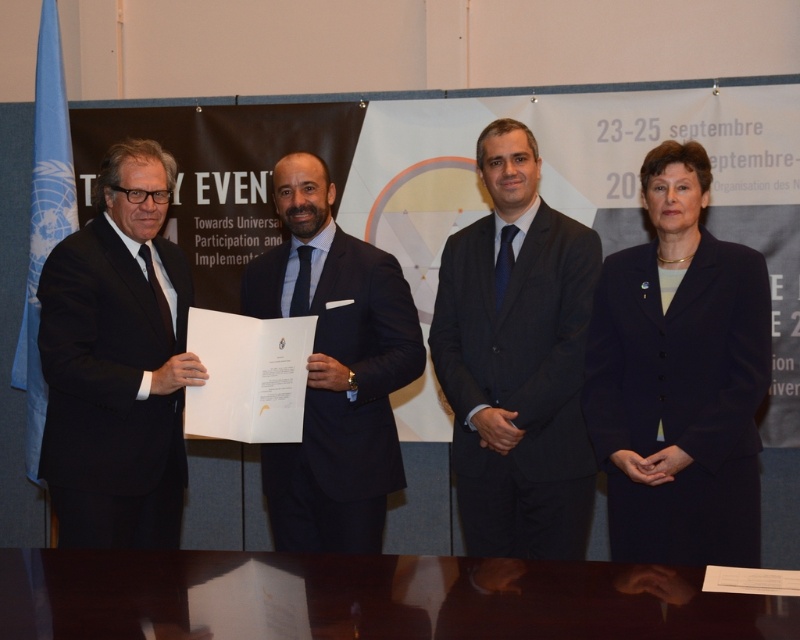
You are standing in front of the backdrop and need to place a glossy wooden table at lower center. According to the scene description, where exactly should you position it?

The glossy wooden table at lower center should be positioned at point (382, 596) as specified in the scene description.